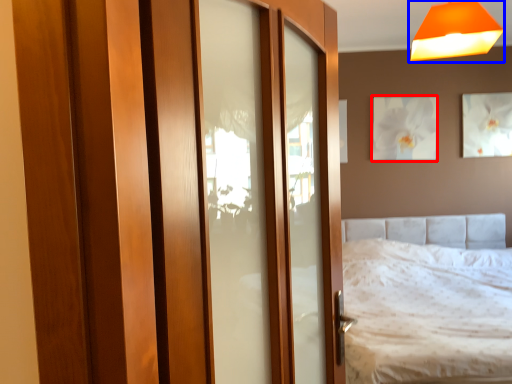
Question: Which object appears closest to the camera in this image, picture frame (highlighted by a red box) or lamp (highlighted by a blue box)?

Choices:
 (A) picture frame
 (B) lamp

Answer: (B)